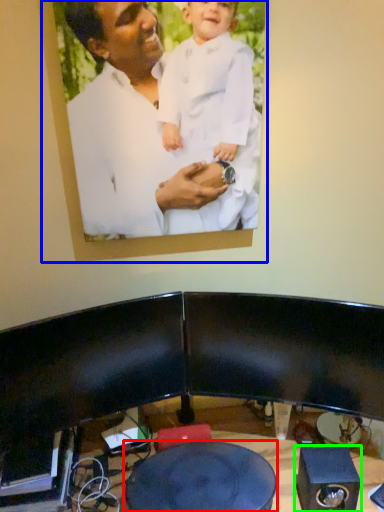
Question: Based on their relative distances, which object is farther from round table (highlighted by a red box)? Choose from picture frame (highlighted by a blue box) and speaker (highlighted by a green box).

Choices:
 (A) picture frame
 (B) speaker

Answer: (A)